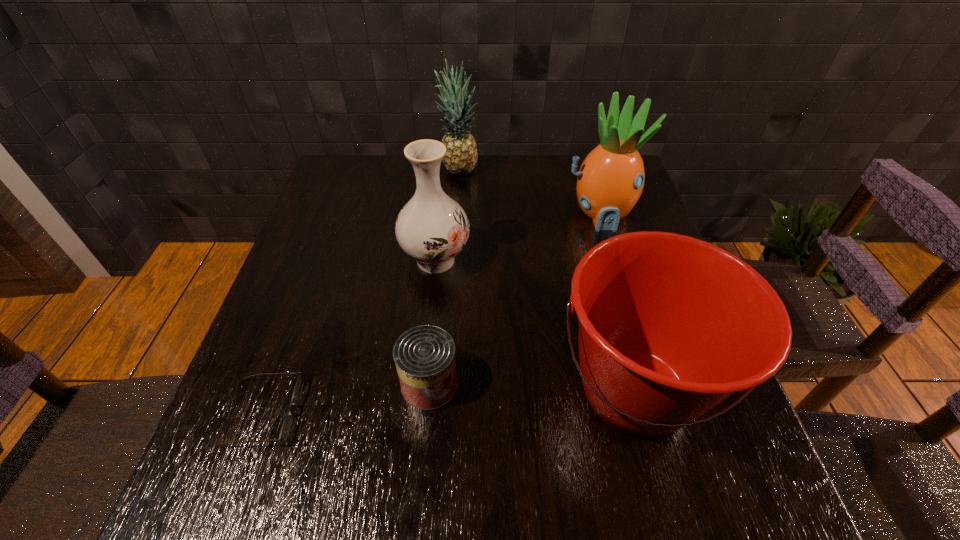
Identify the location of object located in the near right corner section of the desktop. Image resolution: width=960 pixels, height=540 pixels. (670, 326).

In the image, there is a desktop. At what (x,y) coordinates should I click in order to perform the action: click on free space at the far edge. Please return your answer as a coordinate pair (x, y). The image size is (960, 540). Looking at the image, I should click on (402, 197).

The image size is (960, 540). Find the location of `free space at the near edge`. free space at the near edge is located at coordinates (534, 492).

I want to click on vacant space at the left edge of the desktop, so click(288, 267).

You are a GUI agent. You are given a task and a screenshot of the screen. Output one action in this format:
    pyautogui.click(x=<x>, y=<y>)
    Task: Click on the vacant space at the right edge
    
    Given the screenshot: What is the action you would take?
    pyautogui.click(x=622, y=226)

At what (x,y) coordinates should I click in order to perform the action: click on free spot at the far left corner of the desktop. Please return your answer as a coordinate pair (x, y). Looking at the image, I should click on (324, 198).

Where is `vacant space at the near left corner of the desktop`? This screenshot has width=960, height=540. vacant space at the near left corner of the desktop is located at coordinates (207, 475).

Image resolution: width=960 pixels, height=540 pixels. Find the location of `vacant space in between the can and the vase`. vacant space in between the can and the vase is located at coordinates (433, 322).

The image size is (960, 540). I want to click on free point between the third farthest object and the shortest object, so click(349, 336).

Image resolution: width=960 pixels, height=540 pixels. I want to click on vacant area that lies between the second shortest object and the bucket, so click(532, 387).